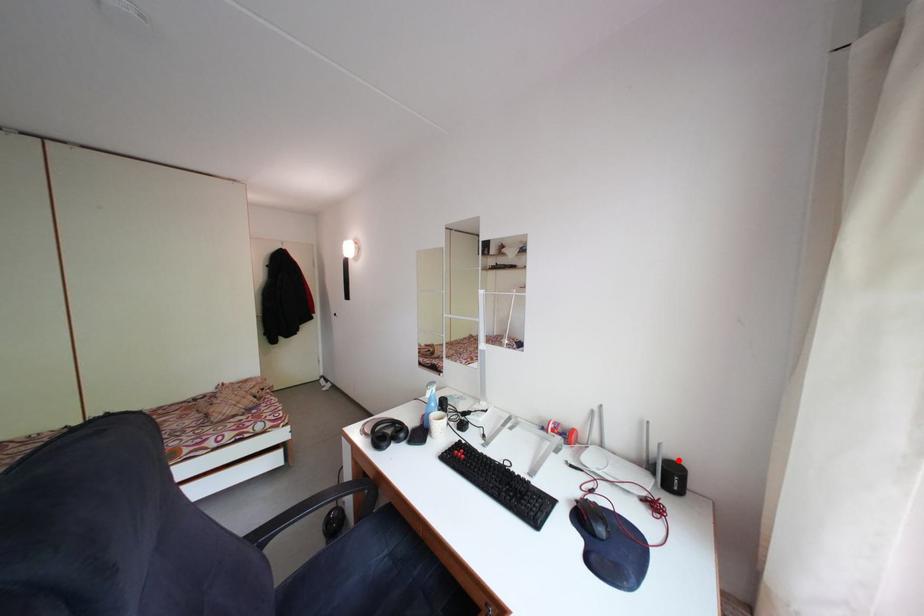
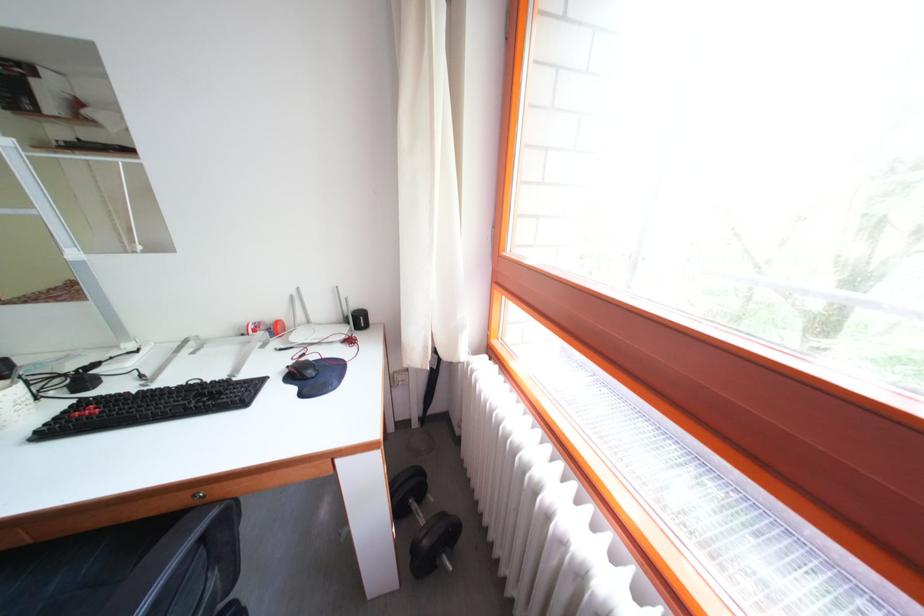
Question: I am providing you with two images of the same scene from different viewpoints. In image1, a red point is highlighted. Considering the same 3D point in image2, which of the following is correct?

Choices:
 (A) It is closer
 (B) It is farther

Answer: (A)